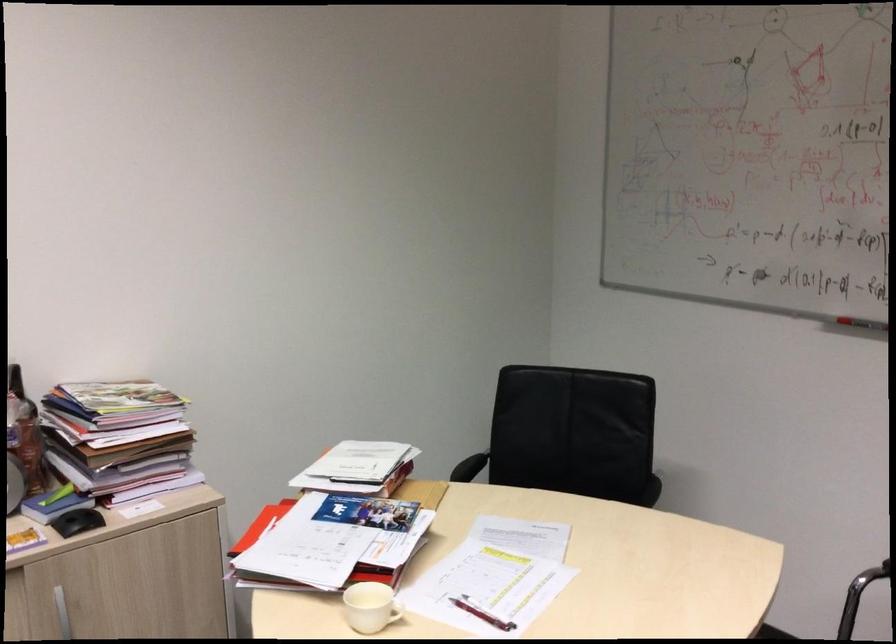
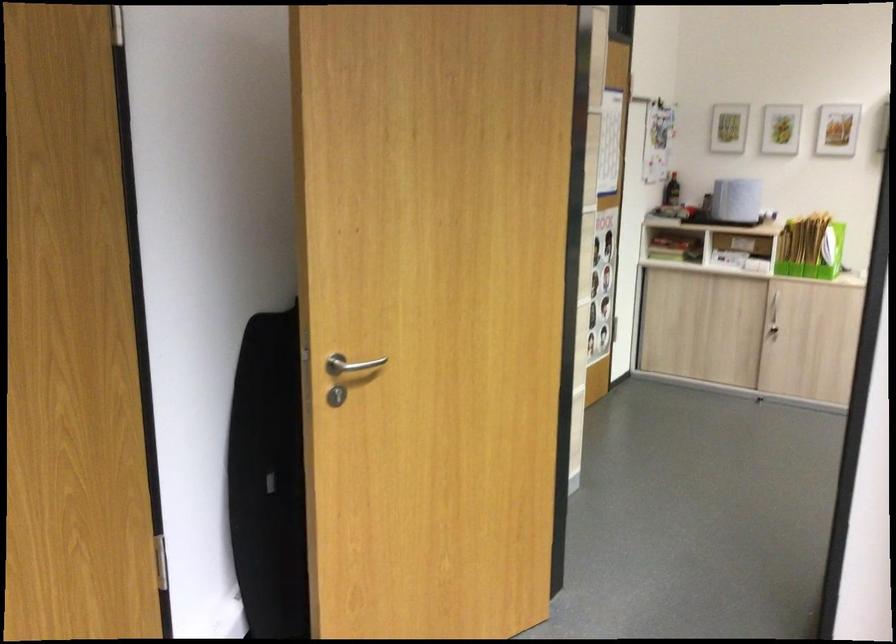
Based on the continuous images, in which direction is the camera rotating?

The camera rotated toward right-down.